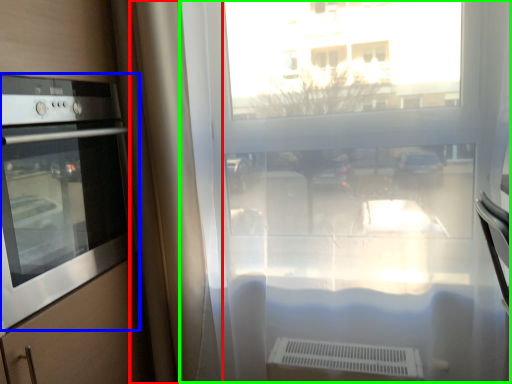
Question: Which is nearer to the curtain (highlighted by a red box)? home appliance (highlighted by a blue box) or window frame (highlighted by a green box).

Choices:
 (A) home appliance
 (B) window frame

Answer: (A)